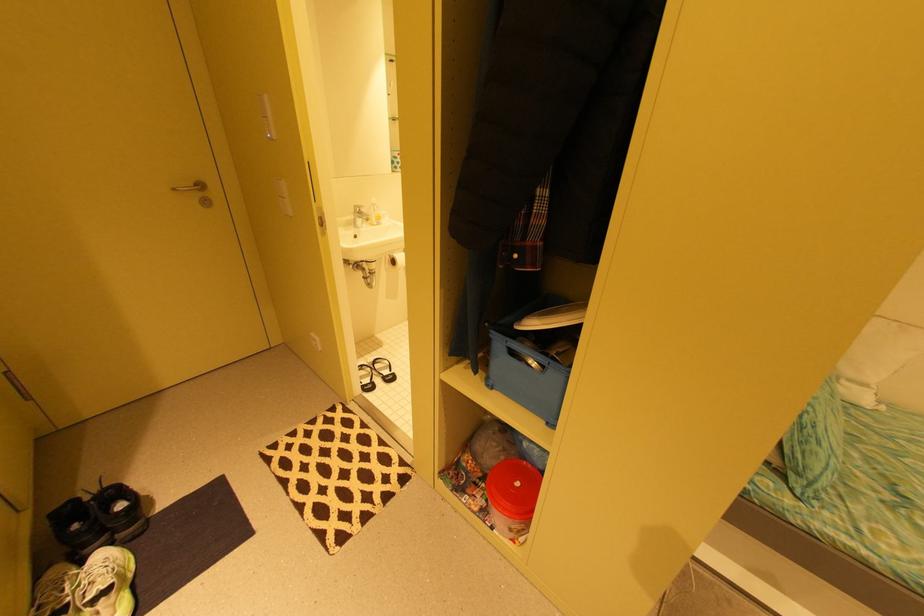
Describe the element at coordinates (377, 216) in the screenshot. I see `the soap dispenser pump` at that location.